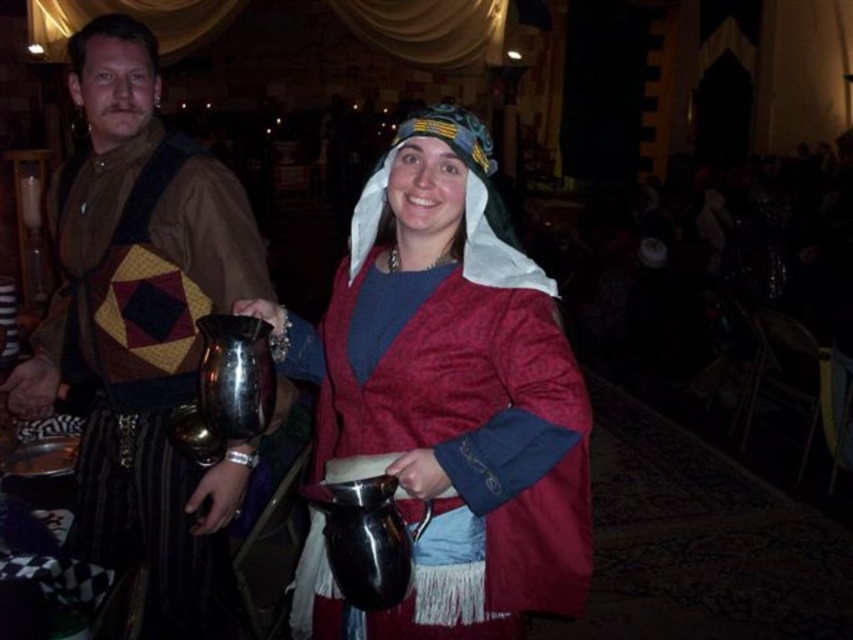
Is metallic jug at center to the left of metallic pitcher at center from the viewer's perspective?

In fact, metallic jug at center is to the right of metallic pitcher at center.

Which is behind, point (398, 404) or point (344, 440)?

Point (344, 440)

Between point (393, 417) and point (88, 28), which one is positioned in front?

Point (393, 417) is more forward.

You are a GUI agent. You are given a task and a screenshot of the screen. Output one action in this format:
    pyautogui.click(x=<x>, y=<y>)
    Task: Click on the metallic jug at center
    The image size is (853, 640).
    Given the screenshot: What is the action you would take?
    pyautogui.click(x=445, y=400)

Who is positioned more to the left, metallic jug at center or brushed metal jug at left?

Positioned to the left is brushed metal jug at left.

Can you confirm if metallic jug at center is positioned below brushed metal jug at left?

No, metallic jug at center is not below brushed metal jug at left.

Image resolution: width=853 pixels, height=640 pixels. In order to click on metallic jug at center in this screenshot , I will do `click(445, 400)`.

Is metallic pitcher at center wider than brushed metal jug at left?

No, metallic pitcher at center is not wider than brushed metal jug at left.

The height and width of the screenshot is (640, 853). What do you see at coordinates (454, 387) in the screenshot?
I see `metallic pitcher at center` at bounding box center [454, 387].

Image resolution: width=853 pixels, height=640 pixels. Find the location of `metallic pitcher at center`. metallic pitcher at center is located at coordinates (454, 387).